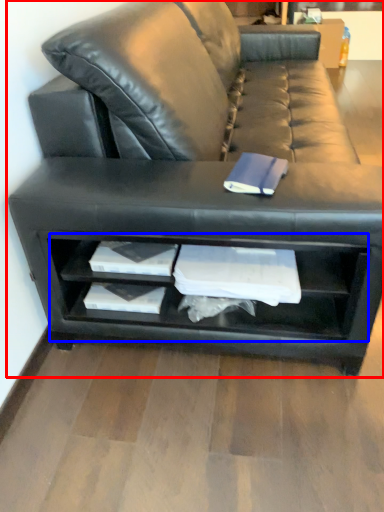
Question: Which object is further to the camera taking this photo, studio couch (highlighted by a red box) or shelf (highlighted by a blue box)?

Choices:
 (A) studio couch
 (B) shelf

Answer: (B)